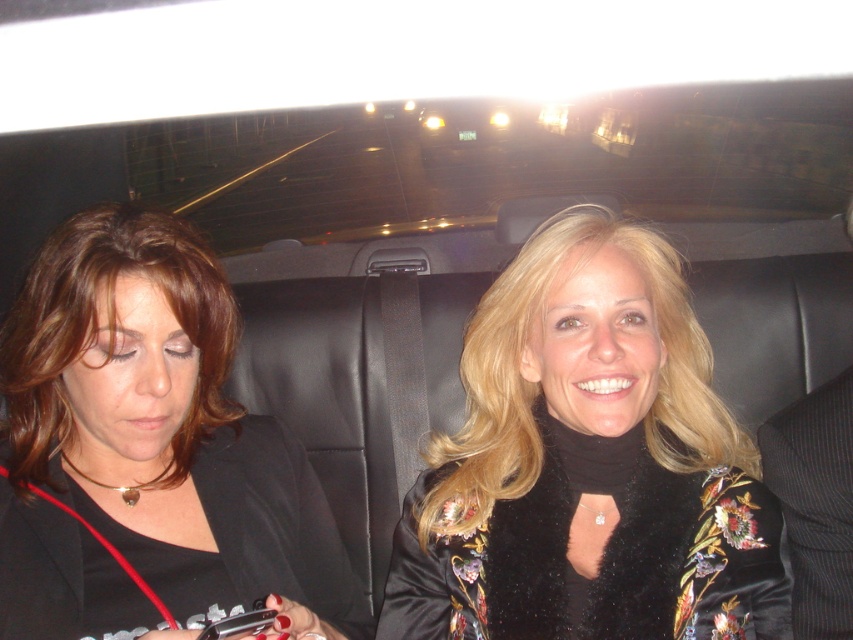
Question: From the image, what is the correct spatial relationship of black velvet jacket at upper right in relation to matte black jacket at left?

Choices:
 (A) right
 (B) left

Answer: (A)

Question: Which point appears farthest from the camera in this image?

Choices:
 (A) [194, 413]
 (B) [438, 566]

Answer: (A)

Question: Considering the relative positions of black velvet jacket at upper right and matte black jacket at left in the image provided, where is black velvet jacket at upper right located with respect to matte black jacket at left?

Choices:
 (A) above
 (B) below

Answer: (A)

Question: Does black velvet jacket at upper right come behind matte black jacket at left?

Choices:
 (A) yes
 (B) no

Answer: (A)